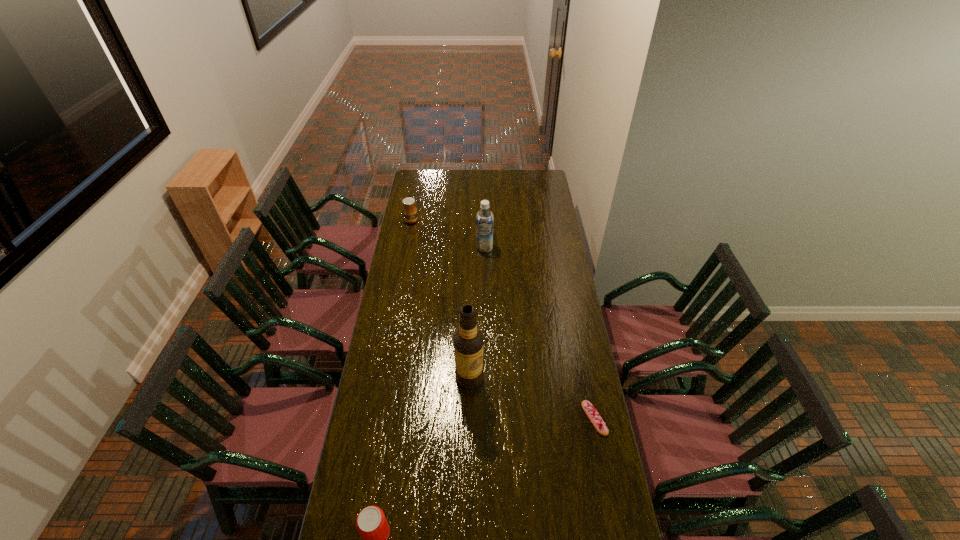
This screenshot has width=960, height=540. Identify the location of blank space at the near edge of the desktop. (408, 533).

Where is `free space at the left edge of the desktop`? free space at the left edge of the desktop is located at coordinates (423, 273).

In the image, there is a desktop. Find the location of `blank space at the right edge`. blank space at the right edge is located at coordinates (555, 265).

Where is `unoccupied position between the fourth nearest object and the alcohol`? Image resolution: width=960 pixels, height=540 pixels. unoccupied position between the fourth nearest object and the alcohol is located at coordinates coord(477,313).

At what (x,y) coordinates should I click in order to perform the action: click on free space between the third nearest object and the farthest object. Please return your answer as a coordinate pair (x, y). This screenshot has width=960, height=540. Looking at the image, I should click on (441, 299).

Identify the location of free space between the second nearest object and the honey. This screenshot has width=960, height=540. (503, 320).

You are a GUI agent. You are given a task and a screenshot of the screen. Output one action in this format:
    pyautogui.click(x=<x>, y=<y>)
    Task: Click on the vacant space in between the alcohol and the farthest object
    The width and height of the screenshot is (960, 540).
    Given the screenshot: What is the action you would take?
    pyautogui.click(x=441, y=299)

The height and width of the screenshot is (540, 960). Identify the location of vacant space that is in between the alcohol and the second tallest object. (477, 313).

The height and width of the screenshot is (540, 960). Identify the location of free space between the farthest object and the tallest object. (441, 299).

Identify the location of free spot between the tallest object and the soya milk. (477, 313).